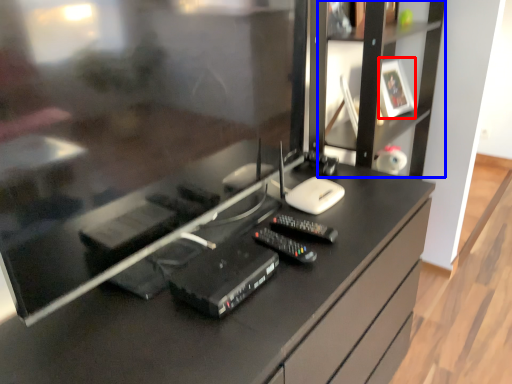
Question: Which of the following is the farthest to the observer, picture frame (highlighted by a red box) or tv cabinet (highlighted by a blue box)?

Choices:
 (A) picture frame
 (B) tv cabinet

Answer: (A)